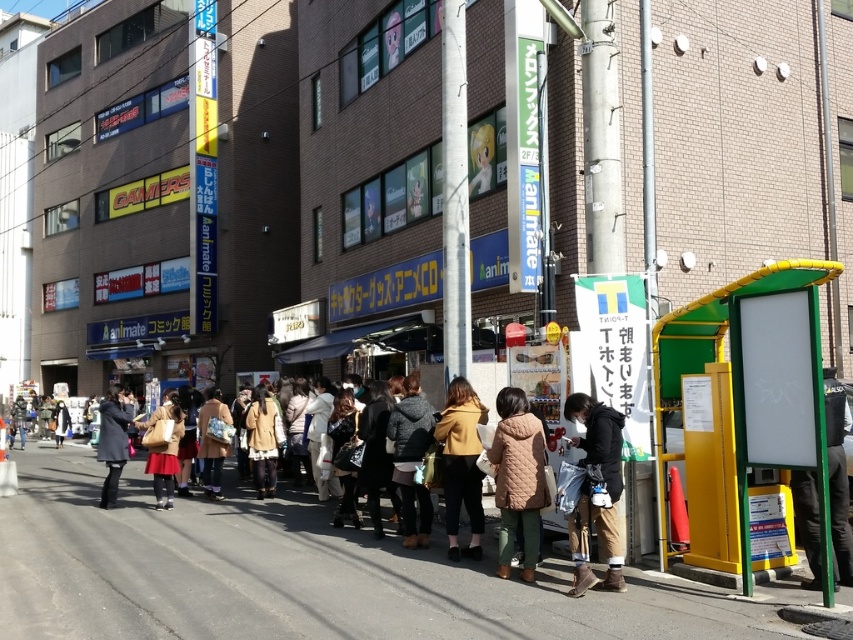
Question: Which point is farther from the camera taking this photo?

Choices:
 (A) (413, 406)
 (B) (656, 456)

Answer: (A)

Question: Which of the following is the farthest from the observer?

Choices:
 (A) brown suede boots at lower right
 (B) brown quilted coat at center

Answer: (B)

Question: Considering the relative positions of dark gray fleece jacket at center and matte gray coat at center in the image provided, where is dark gray fleece jacket at center located with respect to matte gray coat at center?

Choices:
 (A) right
 (B) left

Answer: (A)

Question: Which of the following is the closest to the observer?

Choices:
 (A) brown suede boots at lower right
 (B) matte gray coat at center

Answer: (A)

Question: Is green plastic bus stop at right wider than light brown fabric coat at center?

Choices:
 (A) no
 (B) yes

Answer: (B)

Question: Is light brown fabric coat at center closer to camera compared to matte gray coat at center?

Choices:
 (A) no
 (B) yes

Answer: (A)